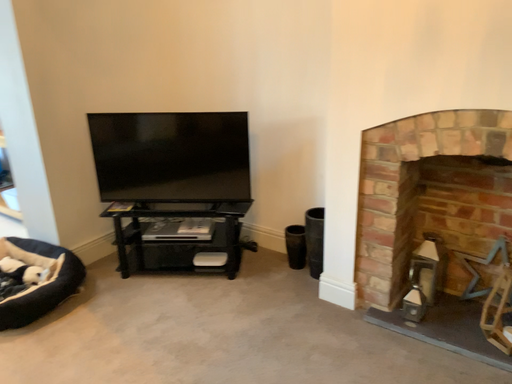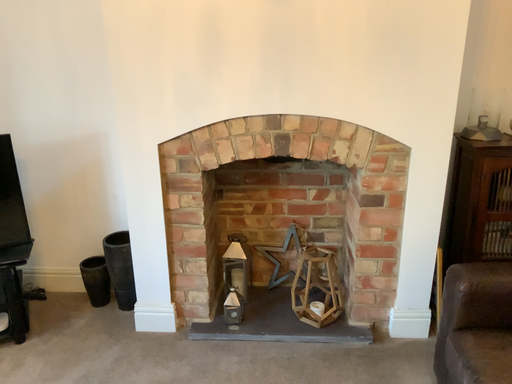
Question: How did the camera likely rotate when shooting the video?

Choices:
 (A) rotated left
 (B) rotated right

Answer: (B)